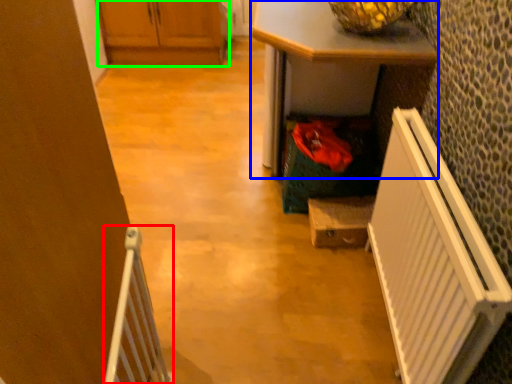
Question: Which is nearer to the radiator (highlighted by a red box)? desk (highlighted by a blue box) or cabinetry (highlighted by a green box).

Choices:
 (A) desk
 (B) cabinetry

Answer: (A)